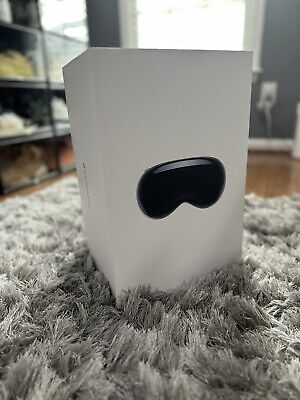
Identify the location of cardboard box. The image size is (300, 400). (191, 251).